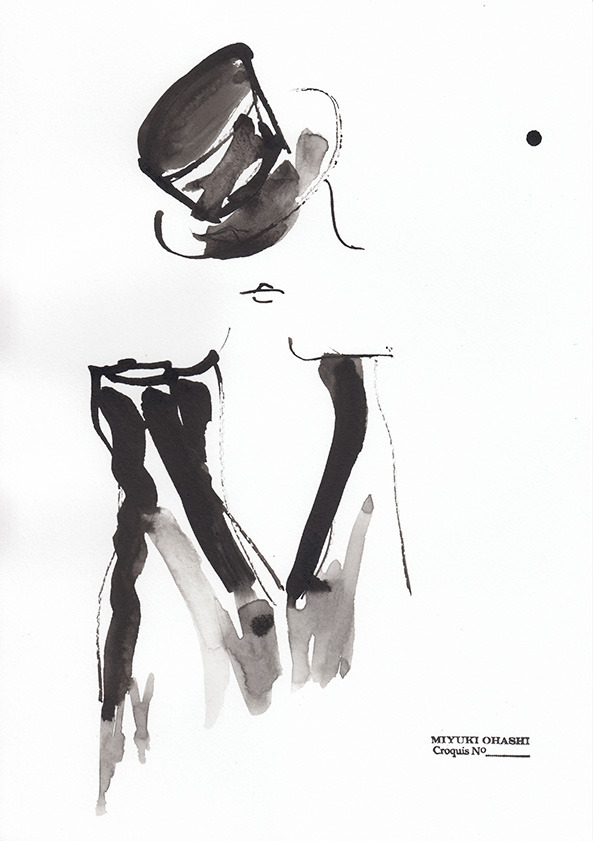
At what (x,y) coordinates should I click in order to perform the action: click on artwork. Please return your answer as a coordinate pair (x, y). Looking at the image, I should click on (262, 378), (109, 691), (431, 90).